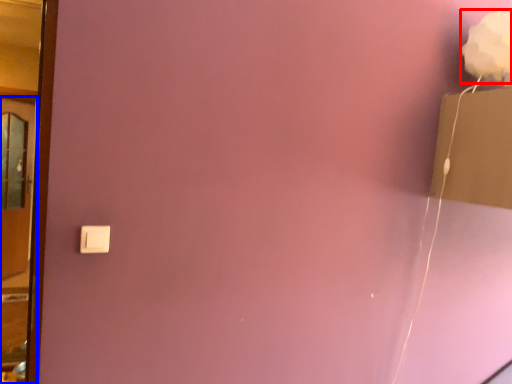
Question: Which point is closer to the camera, flower (highlighted by a red box) or door (highlighted by a blue box)?

Choices:
 (A) flower
 (B) door

Answer: (B)